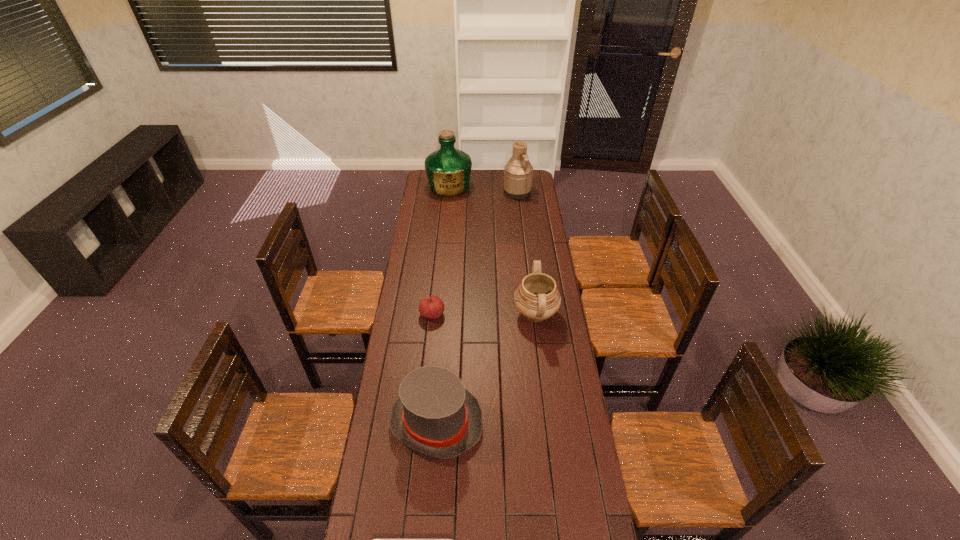
Find the location of a particular element. liquor is located at coordinates (448, 169).

Identify the location of pitcher. (518, 173).

The height and width of the screenshot is (540, 960). Find the location of `urn`. urn is located at coordinates (537, 298).

Image resolution: width=960 pixels, height=540 pixels. Find the location of `the second nearest object`. the second nearest object is located at coordinates (434, 414).

This screenshot has height=540, width=960. Identify the location of tomato. (431, 307).

Locate an element on the screen. blank space located 0.390m on the label side of the liquor is located at coordinates (444, 239).

This screenshot has height=540, width=960. What are the coordinates of `vacant area located 0.170m on the left of the pitcher` in the screenshot? It's located at (476, 192).

The width and height of the screenshot is (960, 540). What are the coordinates of `vacant area situated 0.150m on the front-facing side of the urn` in the screenshot? It's located at (480, 314).

Identify the location of vacant space located on the front-facing side of the urn. (489, 314).

Where is `free space located 0.240m on the front-facing side of the urn`? The width and height of the screenshot is (960, 540). free space located 0.240m on the front-facing side of the urn is located at coordinates (460, 314).